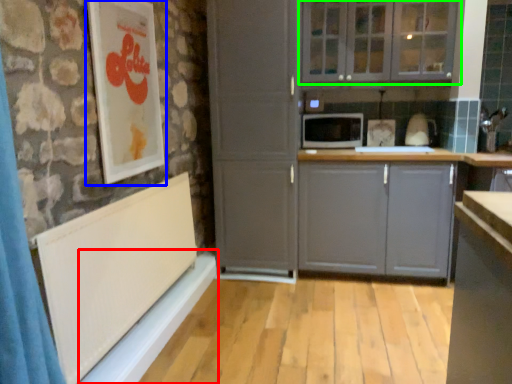
Question: Based on their relative distances, which object is nearer to window sill (highlighted by a red box)? Choose from picture frame (highlighted by a blue box) and cabinetry (highlighted by a green box).

Choices:
 (A) picture frame
 (B) cabinetry

Answer: (A)